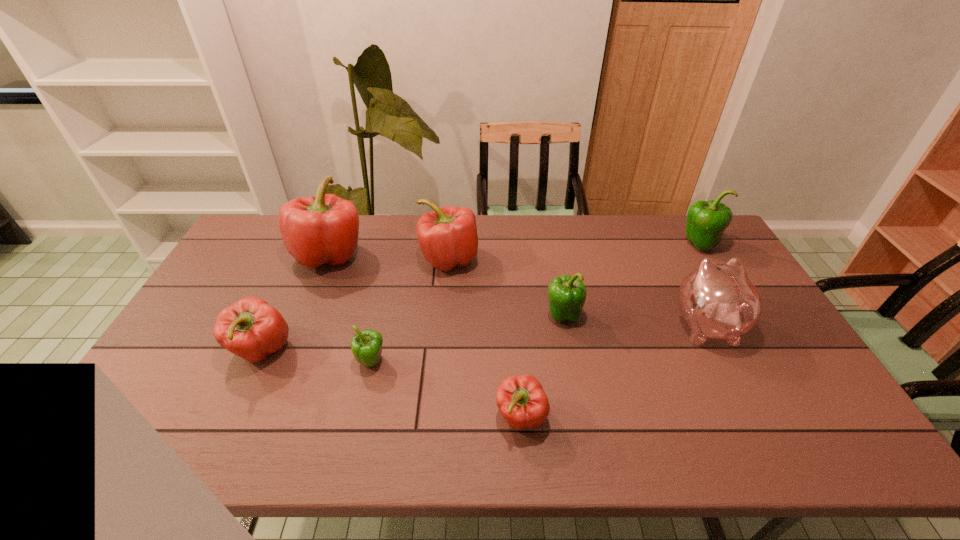
I want to click on the smallest green bell pepper, so click(366, 346).

What are the coordinates of `the nearest object` in the screenshot? It's located at (521, 400).

This screenshot has width=960, height=540. In order to click on the smallest pink bell pepper in this screenshot , I will do `click(521, 400)`.

Locate an element on the screen. free region located 0.160m on the left of the biggest pink bell pepper is located at coordinates (246, 255).

The image size is (960, 540). In order to click on vacant space located on the left of the farthest green bell pepper in this screenshot , I will do `click(626, 245)`.

Locate an element on the screen. The image size is (960, 540). free space located on the left of the fifth object from right to left is located at coordinates (308, 259).

I want to click on free space located 0.380m on the front facing side of the piggy bank, so click(x=656, y=225).

I want to click on free spot located 0.120m on the front facing side of the piggy bank, so click(x=679, y=271).

Identify the location of free spot located 0.160m on the front facing side of the piggy bank. The width and height of the screenshot is (960, 540). (675, 263).

You are a GUI agent. You are given a task and a screenshot of the screen. Output one action in this format:
    pyautogui.click(x=<x>, y=<y>)
    Task: Click on the free space located 0.220m on the left of the sixth bell pepper from left to right
    The width and height of the screenshot is (960, 540).
    Given the screenshot: What is the action you would take?
    pyautogui.click(x=469, y=315)